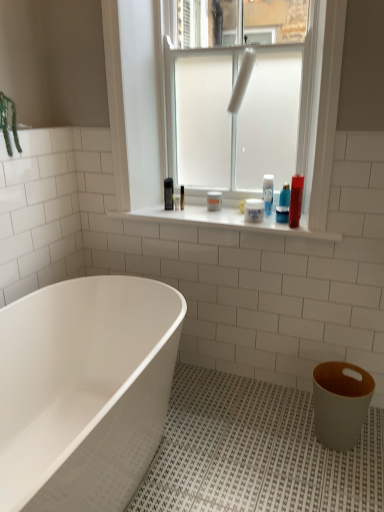
Locate an element on the screen. The image size is (384, 512). white matte jar at center, the first toiletry from the left is located at coordinates pos(254,210).

What is the approximate width of white glossy bathtub at lower left?

It is 28.47 inches.

Measure the distance between point (178,218) and camera.

Point (178,218) and camera are 6.53 feet apart from each other.

Find the location of a particular element. The width and height of the screenshot is (384, 512). green matte plant at upper left is located at coordinates (7, 123).

The image size is (384, 512). I want to click on clear glass window screen at upper center, so click(240, 22).

The width and height of the screenshot is (384, 512). What are the coordinates of `white frosted glass at center` in the screenshot? It's located at (135, 105).

Considering the relative sizes of shiny plastic tube at upper right, the first toiletry in the right-to-left sequence, and white glossy window sill at center in the image provided, is shiny plastic tube at upper right, the first toiletry in the right-to-left sequence, wider than white glossy window sill at center?

No, shiny plastic tube at upper right, the first toiletry in the right-to-left sequence, is not wider than white glossy window sill at center.

Could white glossy window sill at center be considered to be inside shiny plastic tube at upper right, the first toiletry in the right-to-left sequence?

No, white glossy window sill at center is not a part of shiny plastic tube at upper right, the first toiletry in the right-to-left sequence.

Considering the sizes of objects shiny plastic tube at upper right, the first toiletry in the right-to-left sequence, and white glossy window sill at center in the image provided, who is bigger, shiny plastic tube at upper right, the first toiletry in the right-to-left sequence, or white glossy window sill at center?

white glossy window sill at center.

How many degrees apart are the facing directions of shiny plastic tube at upper right, marked as the 2th toiletry in a left-to-right arrangement, and white glossy window sill at center?

shiny plastic tube at upper right, marked as the 2th toiletry in a left-to-right arrangement, and white glossy window sill at center are facing 0.291 degrees away from each other.

Who is shorter, white matte toilet bowl at lower right or clear glass window screen at upper center?

clear glass window screen at upper center.

From the image's perspective, who appears lower, white matte toilet bowl at lower right or clear glass window screen at upper center?

white matte toilet bowl at lower right is shown below in the image.

Find the location of a particular element. toilet bowl below the clear glass window screen at upper center (from a real-world perspective) is located at coordinates (340, 403).

Considering the sizes of white matte toilet bowl at lower right and clear glass window screen at upper center in the image, is white matte toilet bowl at lower right wider or thinner than clear glass window screen at upper center?

In the image, white matte toilet bowl at lower right appears to be wider than clear glass window screen at upper center.

Is shiny plastic tube at upper right, the first toiletry in the right-to-left sequence, oriented away from white matte jar at center, the first toiletry from the left?

No, shiny plastic tube at upper right, the first toiletry in the right-to-left sequence, is not facing away from white matte jar at center, the first toiletry from the left.

Do you think shiny plastic tube at upper right, marked as the 2th toiletry in a left-to-right arrangement, is within white matte jar at center, the 2th toiletry when ordered from right to left, or outside of it?

shiny plastic tube at upper right, marked as the 2th toiletry in a left-to-right arrangement, exists outside the volume of white matte jar at center, the 2th toiletry when ordered from right to left.

From a real-world perspective, is shiny plastic tube at upper right, the first toiletry in the right-to-left sequence, above or below white matte jar at center, the 2th toiletry when ordered from right to left?

Clearly, from a real-world perspective, shiny plastic tube at upper right, the first toiletry in the right-to-left sequence, is above white matte jar at center, the 2th toiletry when ordered from right to left.

Is shiny plastic tube at upper right, marked as the 2th toiletry in a left-to-right arrangement, positioned far away from white matte jar at center, the 2th toiletry when ordered from right to left?

That's not correct — shiny plastic tube at upper right, marked as the 2th toiletry in a left-to-right arrangement, is a little close to white matte jar at center, the 2th toiletry when ordered from right to left.

Could you tell me if white glossy bathtub at lower left is facing green matte plant at upper left?

No.

Considering the sizes of white glossy bathtub at lower left and green matte plant at upper left in the image, is white glossy bathtub at lower left wider or thinner than green matte plant at upper left?

Considering their sizes, white glossy bathtub at lower left looks broader than green matte plant at upper left.

Considering the relative sizes of white glossy bathtub at lower left and green matte plant at upper left in the image provided, is white glossy bathtub at lower left smaller than green matte plant at upper left?

No.

Is white matte jar at center, the first toiletry from the left, spatially inside white frosted glass at center, or outside of it?

white matte jar at center, the first toiletry from the left, is not inside white frosted glass at center, it's outside.

Between white matte jar at center, the first toiletry from the left, and white frosted glass at center, which one has smaller width?

With smaller width is white frosted glass at center.

From the image's perspective, relative to white frosted glass at center, is white matte jar at center, the 2th toiletry when ordered from right to left, above or below?

Clearly, from the image's perspective, white matte jar at center, the 2th toiletry when ordered from right to left, is below white frosted glass at center.

In the scene shown: Between white matte jar at center, the 2th toiletry when ordered from right to left, and white frosted glass at center, which one has less height?

Standing shorter between the two is white matte jar at center, the 2th toiletry when ordered from right to left.

From the picture: From a real-world perspective, relative to white matte jar at center, the 2th toiletry when ordered from right to left, is white glossy window sill at center vertically above or below?

Clearly, from a real-world perspective, white glossy window sill at center is below white matte jar at center, the 2th toiletry when ordered from right to left.

Which is behind, white glossy window sill at center or white matte jar at center, the 2th toiletry when ordered from right to left?

white matte jar at center, the 2th toiletry when ordered from right to left, is more distant.

Is white glossy window sill at center at the right side of white matte jar at center, the 2th toiletry when ordered from right to left?

Incorrect, white glossy window sill at center is not on the right side of white matte jar at center, the 2th toiletry when ordered from right to left.

Considering the relative sizes of white glossy window sill at center and white matte jar at center, the first toiletry from the left, in the image provided, is white glossy window sill at center wider than white matte jar at center, the first toiletry from the left,?

Yes.

Is green matte plant at upper left taller or shorter than white matte jar at center, the 2th toiletry when ordered from right to left?

In the image, green matte plant at upper left appears to be taller than white matte jar at center, the 2th toiletry when ordered from right to left.

Which is behind, point (7, 132) or point (260, 221)?

The point (260, 221) is more distant.

Which is correct: green matte plant at upper left is inside white matte jar at center, the 2th toiletry when ordered from right to left, or outside of it?

The correct answer is: outside.

Is green matte plant at upper left wider or thinner than white matte jar at center, the 2th toiletry when ordered from right to left?

Considering their sizes, green matte plant at upper left looks broader than white matte jar at center, the 2th toiletry when ordered from right to left.

Where is `toiletry that is the 1st one when counting backward from the white glossy window sill at center`? This screenshot has width=384, height=512. toiletry that is the 1st one when counting backward from the white glossy window sill at center is located at coordinates (296, 200).

Where is `toilet bowl that appears below the clear glass window screen at upper center (from a real-world perspective)`? The image size is (384, 512). toilet bowl that appears below the clear glass window screen at upper center (from a real-world perspective) is located at coordinates (340, 403).

Considering their positions, is shiny plastic tube at upper right, marked as the 2th toiletry in a left-to-right arrangement, positioned closer to white glossy bathtub at lower left than white frosted glass at center?

white frosted glass at center.

From the image, which object appears to be farther from clear glass window screen at upper center, white matte toilet bowl at lower right or white frosted glass at center?

white matte toilet bowl at lower right is positioned further to the anchor clear glass window screen at upper center.

From the image, which object appears to be nearer to white glossy window sill at center, white frosted glass at center or white glossy bathtub at lower left?

The object closer to white glossy window sill at center is white frosted glass at center.

Consider the image. Estimate the real-world distances between objects in this image. Which object is closer to green matte plant at upper left, clear glass window screen at upper center or white glossy window sill at center?

white glossy window sill at center.

Considering their positions, is white matte jar at center, the 2th toiletry when ordered from right to left, positioned further to white glossy window sill at center than green matte plant at upper left?

green matte plant at upper left is further to white glossy window sill at center.

From the picture: Estimate the real-world distances between objects in this image. Which object is closer to white glossy window sill at center, white matte toilet bowl at lower right or clear glass window screen at upper center?

white matte toilet bowl at lower right.

Looking at this image, looking at the image, which one is located further to green matte plant at upper left, white frosted glass at center or white glossy window sill at center?

white glossy window sill at center lies further to green matte plant at upper left than the other object.

Considering their positions, is white matte jar at center, the first toiletry from the left, positioned further to clear glass window screen at upper center than white glossy bathtub at lower left?

Among the two, white glossy bathtub at lower left is located further to clear glass window screen at upper center.

Locate an element on the screen. toiletry between white glossy window sill at center and shiny plastic tube at upper right, marked as the 2th toiletry in a left-to-right arrangement, from left to right is located at coordinates (254, 210).

Find the location of `toiletry that lies between clear glass window screen at upper center and white glossy window sill at center from top to bottom`. toiletry that lies between clear glass window screen at upper center and white glossy window sill at center from top to bottom is located at coordinates (296, 200).

Locate an element on the screen. toiletry between white frosted glass at center and white glossy window sill at center from top to bottom is located at coordinates (296, 200).

Locate an element on the screen. The width and height of the screenshot is (384, 512). window that lies between clear glass window screen at upper center and shiny plastic tube at upper right, marked as the 2th toiletry in a left-to-right arrangement, from top to bottom is located at coordinates (135, 105).